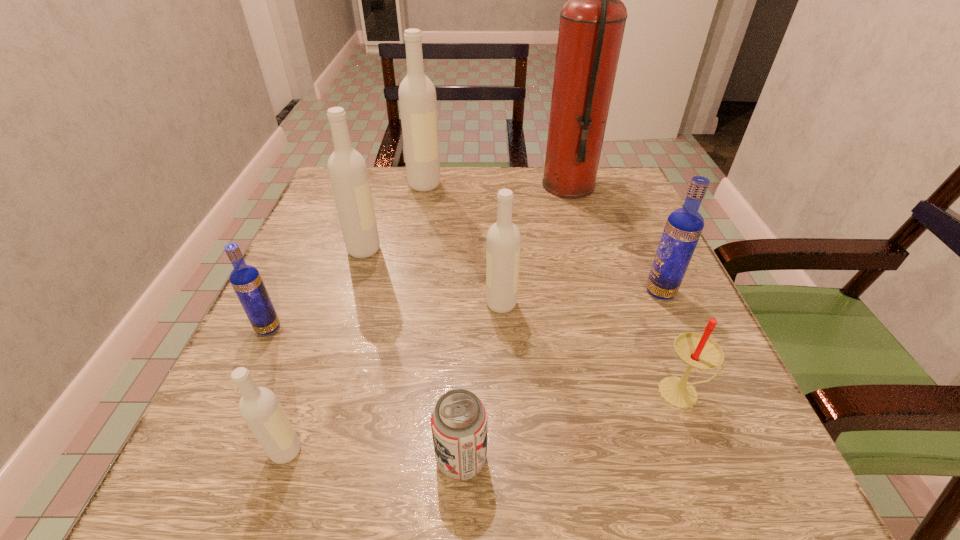
Image resolution: width=960 pixels, height=540 pixels. In order to click on vacant space that is in between the biggest white vodka and the candle in this screenshot , I will do `click(554, 288)`.

The height and width of the screenshot is (540, 960). Identify the location of vacant area between the eighth shortest object and the third nearest object. (554, 288).

Identify the location of free space between the second farthest white vodka and the leftmost object. (316, 288).

I want to click on blank region between the fifth object from left to right and the nearest vodka, so click(373, 455).

Select which object is the fifth closest to the farther blue vodka. Please provide its 2D coordinates. Your answer should be formatted as a tuple, i.e. [(x, y)], where the tuple contains the x and y coordinates of a point satisfying the conditions above.

[(417, 96)]

Select which object is the eighth closest to the tallest object. Please provide its 2D coordinates. Your answer should be formatted as a tuple, i.e. [(x, y)], where the tuple contains the x and y coordinates of a point satisfying the conditions above.

[(259, 407)]

Select which vodka appears as the fifth closest to the farthest vodka. Please provide its 2D coordinates. Your answer should be formatted as a tuple, i.e. [(x, y)], where the tuple contains the x and y coordinates of a point satisfying the conditions above.

[(259, 407)]

Locate which vodka ranks third in proximity to the nearer blue vodka. Please provide its 2D coordinates. Your answer should be formatted as a tuple, i.e. [(x, y)], where the tuple contains the x and y coordinates of a point satisfying the conditions above.

[(503, 246)]

I want to click on white vodka that is the second nearest to the shortest object, so click(x=503, y=246).

This screenshot has height=540, width=960. In order to click on the closest white vodka to the nearest white vodka in this screenshot , I will do `click(503, 246)`.